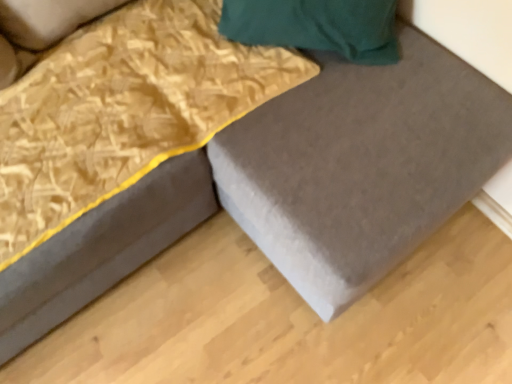
Question: Does matte gray bed frame at lower left appear on the left side of matte gray plywood at lower right?

Choices:
 (A) yes
 (B) no

Answer: (A)

Question: Is matte gray bed frame at lower left directly adjacent to matte gray plywood at lower right?

Choices:
 (A) yes
 (B) no

Answer: (B)

Question: From the image's perspective, would you say matte gray bed frame at lower left is shown under matte gray plywood at lower right?

Choices:
 (A) no
 (B) yes

Answer: (A)

Question: Is matte gray bed frame at lower left surrounding matte gray plywood at lower right?

Choices:
 (A) yes
 (B) no

Answer: (B)

Question: Is matte gray bed frame at lower left positioned far away from matte gray plywood at lower right?

Choices:
 (A) no
 (B) yes

Answer: (A)

Question: Considering the relative sizes of matte gray bed frame at lower left and matte gray plywood at lower right in the image provided, is matte gray bed frame at lower left thinner than matte gray plywood at lower right?

Choices:
 (A) no
 (B) yes

Answer: (B)

Question: Is matte gray bed frame at lower left wider than gold textured blanket at upper left?

Choices:
 (A) no
 (B) yes

Answer: (B)

Question: From a real-world perspective, is matte gray bed frame at lower left located beneath gold textured blanket at upper left?

Choices:
 (A) yes
 (B) no

Answer: (A)

Question: Can you confirm if matte gray bed frame at lower left is shorter than gold textured blanket at upper left?

Choices:
 (A) yes
 (B) no

Answer: (B)

Question: Can you confirm if matte gray bed frame at lower left is positioned to the right of gold textured blanket at upper left?

Choices:
 (A) no
 (B) yes

Answer: (A)

Question: Is matte gray bed frame at lower left looking in the opposite direction of gold textured blanket at upper left?

Choices:
 (A) no
 (B) yes

Answer: (B)

Question: Is matte gray bed frame at lower left positioned before gold textured blanket at upper left?

Choices:
 (A) yes
 (B) no

Answer: (A)

Question: From a real-world perspective, is gold textured blanket at upper left physically below matte gray bed frame at lower left?

Choices:
 (A) yes
 (B) no

Answer: (B)